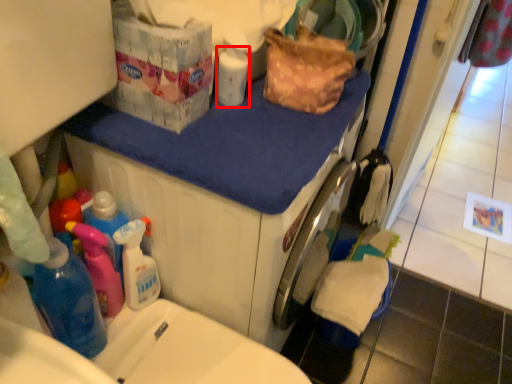
Question: From the image's perspective, where is cleaning product (annotated by the red box) located relative to counter top?

Choices:
 (A) below
 (B) above

Answer: (B)